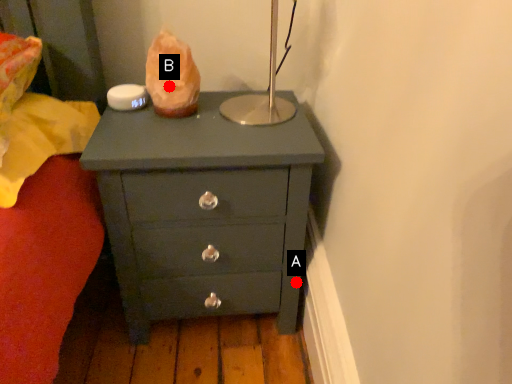
Question: Two points are circled on the image, labeled by A and B beside each circle. Among these points, which one is nearest to the camera?

Choices:
 (A) A is closer
 (B) B is closer

Answer: (B)